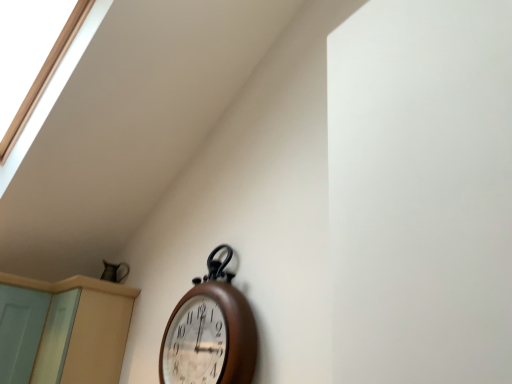
Question: Is light blue wood screen door at lower left shorter than beige wood dresser at lower left?

Choices:
 (A) yes
 (B) no

Answer: (B)

Question: Does light blue wood screen door at lower left have a larger size compared to beige wood dresser at lower left?

Choices:
 (A) no
 (B) yes

Answer: (A)

Question: Does light blue wood screen door at lower left appear on the left side of beige wood dresser at lower left?

Choices:
 (A) yes
 (B) no

Answer: (A)

Question: From the image's perspective, is light blue wood screen door at lower left under beige wood dresser at lower left?

Choices:
 (A) yes
 (B) no

Answer: (B)

Question: Is light blue wood screen door at lower left smaller than beige wood dresser at lower left?

Choices:
 (A) yes
 (B) no

Answer: (A)

Question: Is the depth of light blue wood screen door at lower left greater than that of beige wood dresser at lower left?

Choices:
 (A) no
 (B) yes

Answer: (B)

Question: Considering the relative sizes of wooden wall clock at center and light blue wood screen door at lower left in the image provided, is wooden wall clock at center bigger than light blue wood screen door at lower left?

Choices:
 (A) no
 (B) yes

Answer: (A)

Question: Is wooden wall clock at center aimed at light blue wood screen door at lower left?

Choices:
 (A) no
 (B) yes

Answer: (A)

Question: From a real-world perspective, does wooden wall clock at center stand above light blue wood screen door at lower left?

Choices:
 (A) yes
 (B) no

Answer: (A)

Question: Considering the relative positions of wooden wall clock at center and light blue wood screen door at lower left in the image provided, is wooden wall clock at center to the right of light blue wood screen door at lower left from the viewer's perspective?

Choices:
 (A) yes
 (B) no

Answer: (A)

Question: Is wooden wall clock at center directly adjacent to light blue wood screen door at lower left?

Choices:
 (A) yes
 (B) no

Answer: (B)

Question: Does wooden wall clock at center have a smaller size compared to light blue wood screen door at lower left?

Choices:
 (A) no
 (B) yes

Answer: (B)

Question: From a real-world perspective, is light blue wood screen door at lower left beneath wooden wall clock at center?

Choices:
 (A) yes
 (B) no

Answer: (A)